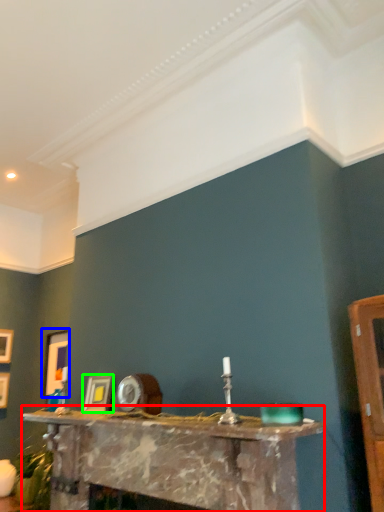
Question: Which object is positioned farthest from table (highlighted by a red box)? Select from picture frame (highlighted by a blue box) and picture frame (highlighted by a green box).

Choices:
 (A) picture frame
 (B) picture frame

Answer: (A)